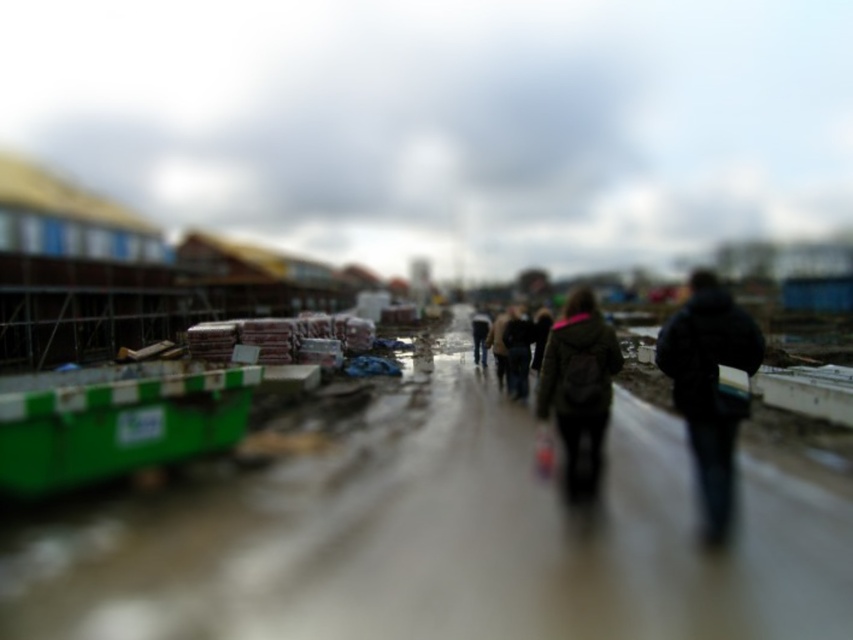
Question: Which point appears farthest from the camera in this image?

Choices:
 (A) (573, 419)
 (B) (724, 422)
 (C) (61, 552)

Answer: (A)

Question: Which point appears closest to the camera in this image?

Choices:
 (A) (706, 536)
 (B) (485, 612)
 (C) (589, 481)

Answer: (B)

Question: Is green plastic containers at left positioned in front of black matte jacket at right?

Choices:
 (A) no
 (B) yes

Answer: (B)

Question: In this image, where is green plastic containers at left located relative to black matte jacket at right?

Choices:
 (A) right
 (B) left

Answer: (B)

Question: Which of the following is the closest to the observer?

Choices:
 (A) (711, 588)
 (B) (585, 301)
 (C) (709, 337)

Answer: (A)

Question: Is green plastic containers at left in front of dark green jacket at center?

Choices:
 (A) no
 (B) yes

Answer: (B)